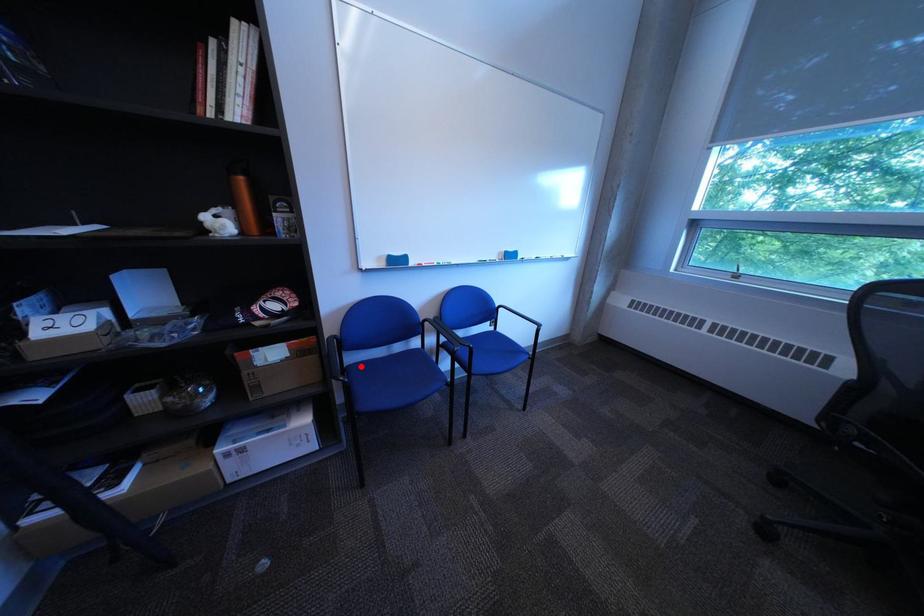
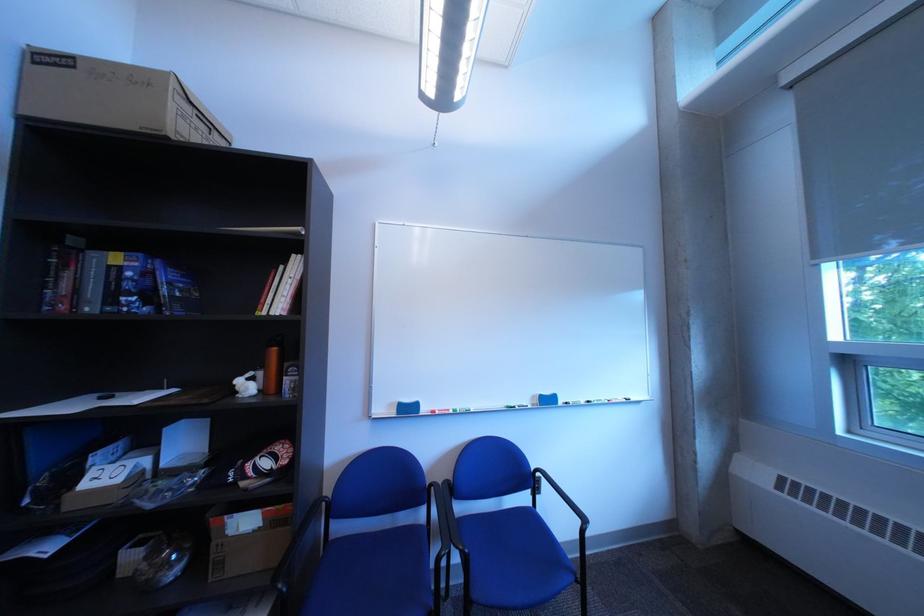
Question: I am providing you with two images of the same scene from different viewpoints. In image1, a red point is highlighted. Considering the same 3D point in image2, which of the following is correct?

Choices:
 (A) It is closer
 (B) It is farther

Answer: (B)